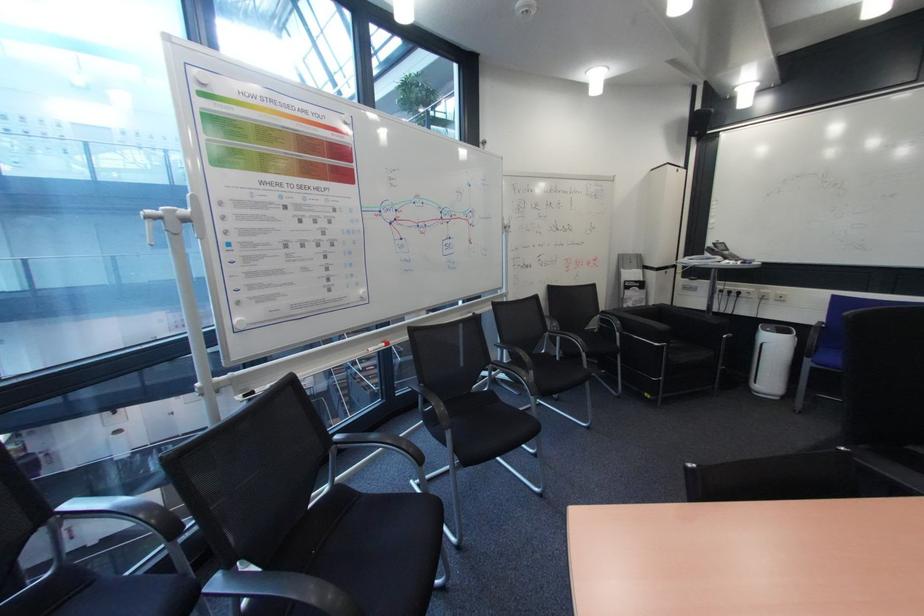
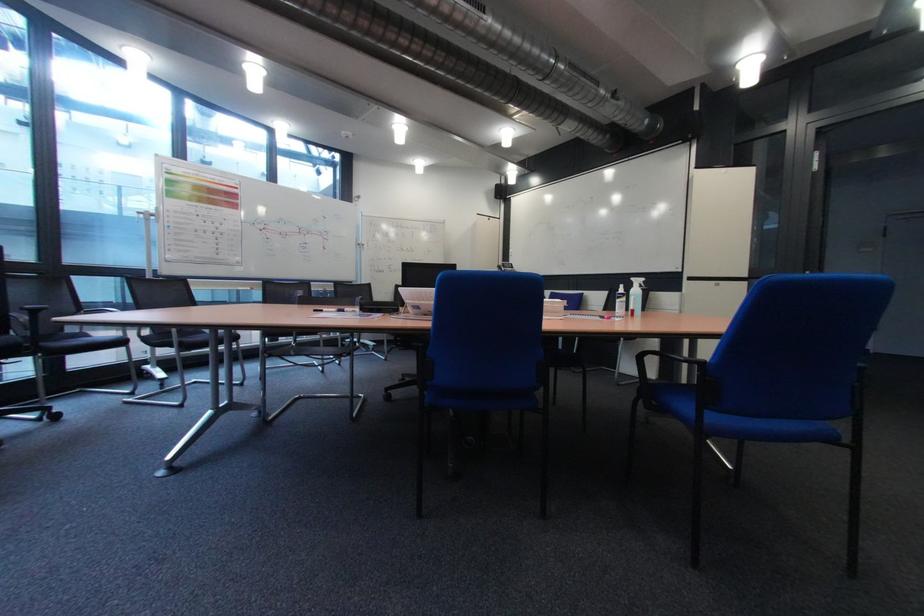
The images are taken continuously from a first-person perspective. In which direction are you moving?

The movement direction of the cameraman is right, backward.